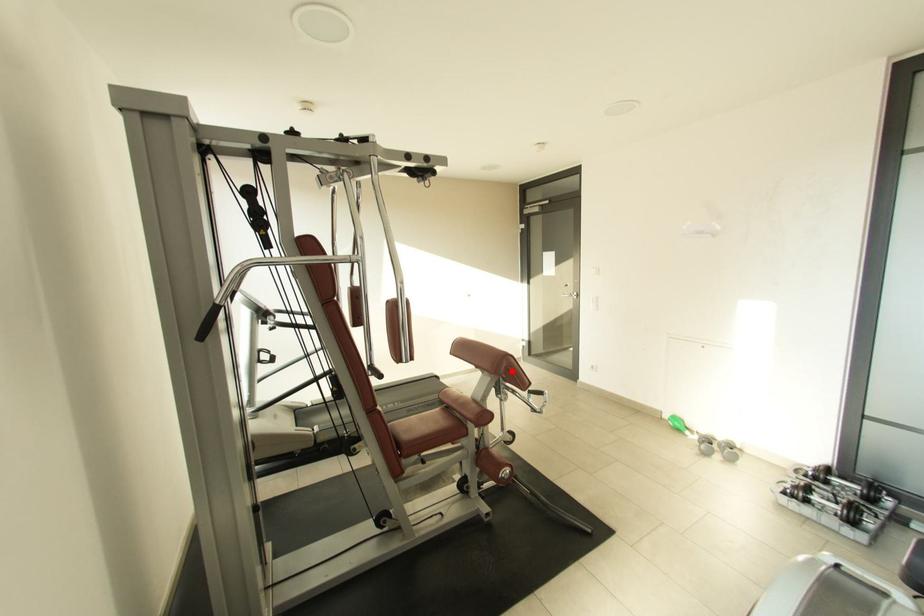
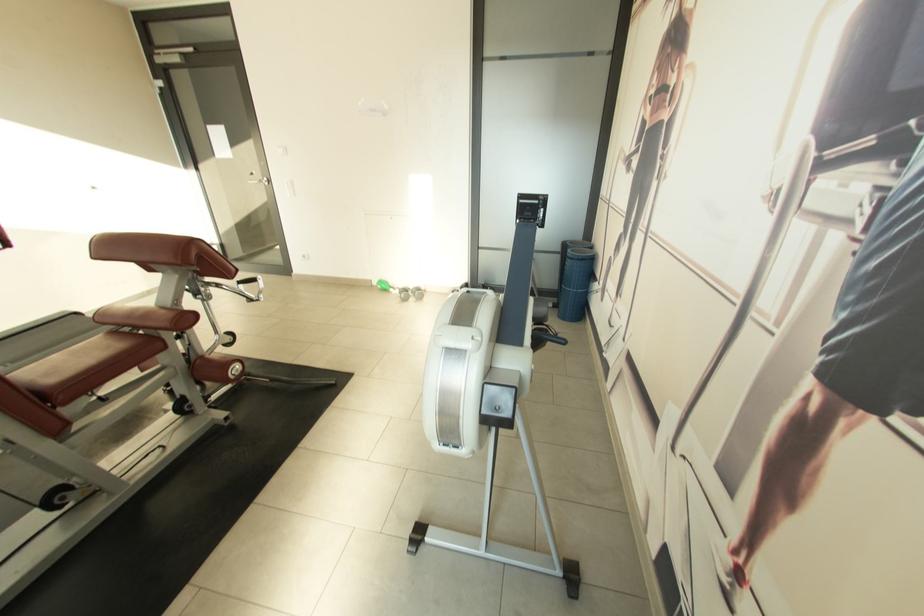
Question: I am providing you with two images of the same scene from different viewpoints. In image1, a red point is highlighted. Considering the same 3D point in image2, which of the following is correct?

Choices:
 (A) It is closer
 (B) It is farther

Answer: (A)